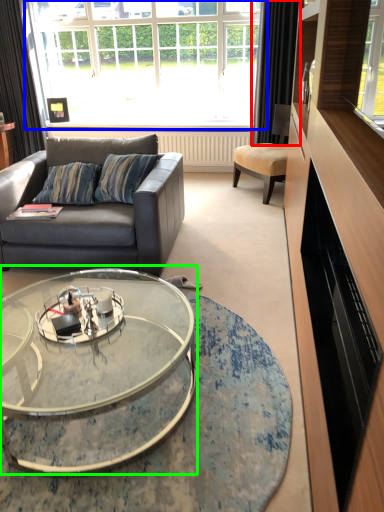
Question: Estimate the real-world distances between objects in this image. Which object is closer to curtain (highlighted by a red box), window (highlighted by a blue box) or coffee table (highlighted by a green box)?

Choices:
 (A) window
 (B) coffee table

Answer: (A)